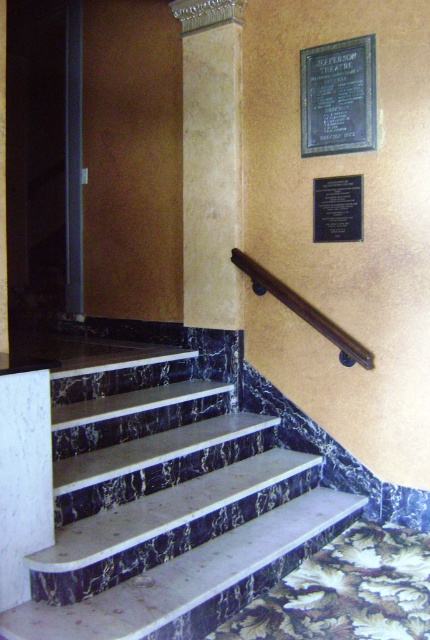
Does point (187, 243) come farther from viewer compared to point (362, 108)?

Yes, point (187, 243) is farther from viewer.

Which is behind, point (240, 304) or point (350, 44)?

Point (240, 304)

This screenshot has width=430, height=640. In order to click on smooth beige column at center in this screenshot , I will do `click(211, 161)`.

The height and width of the screenshot is (640, 430). I want to click on smooth beige column at center, so click(x=211, y=161).

Who is positioned more to the left, smooth beige column at center or black polished wood plaque at upper center?

smooth beige column at center is more to the left.

Does smooth beige column at center appear on the left side of black polished wood plaque at upper center?

Yes, smooth beige column at center is to the left of black polished wood plaque at upper center.

Which is behind, point (218, 204) or point (322, 228)?

The point (218, 204) is more distant.

Locate an element on the screen. Image resolution: width=430 pixels, height=640 pixels. smooth beige column at center is located at coordinates (211, 161).

Between point (315, 310) and point (362, 228), which one is positioned behind?

The point (315, 310) is more distant.

Consider the image. Who is positioned more to the right, brown polished wood handrail at upper center or black polished wood plaque at upper center?

black polished wood plaque at upper center is more to the right.

Identify the location of brown polished wood handrail at upper center. (303, 310).

The height and width of the screenshot is (640, 430). I want to click on brown polished wood handrail at upper center, so click(x=303, y=310).